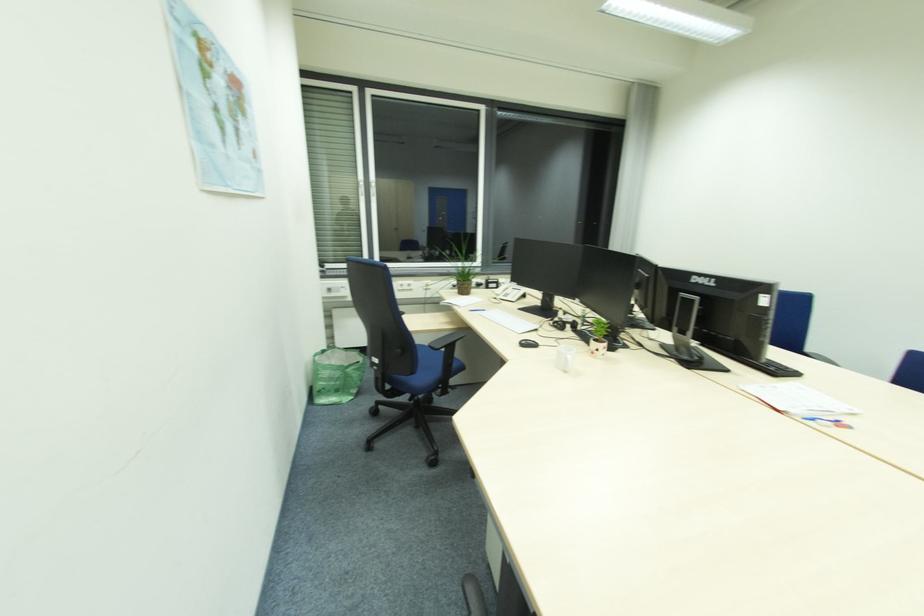
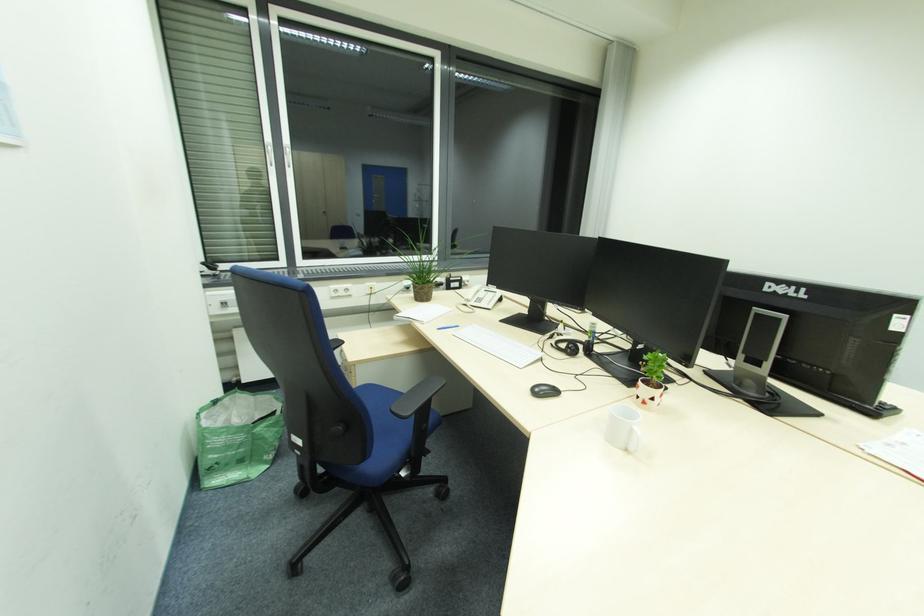
Question: In a continuous first-person perspective shot, in which direction is the camera moving?

Choices:
 (A) Left
 (B) Right
 (C) Forward
 (D) Backward

Answer: (C)